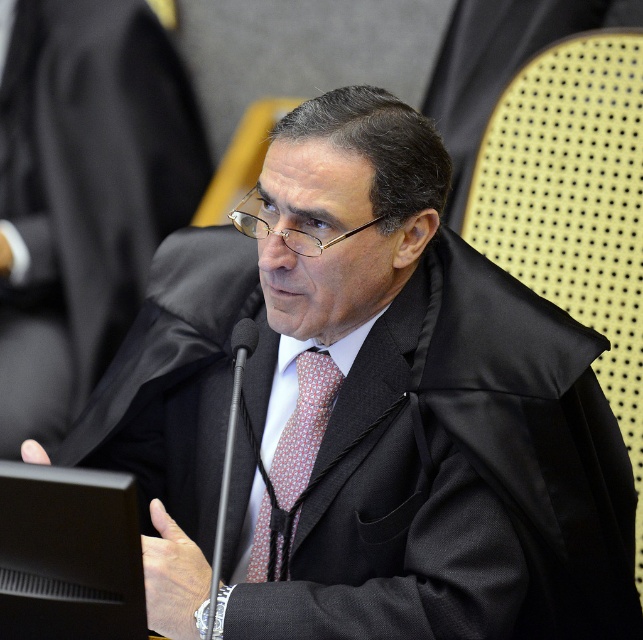
In the scene shown: Can you confirm if red dotted tie at center is taller than black plastic microphone at center?

Indeed, red dotted tie at center has a greater height compared to black plastic microphone at center.

Measure the distance between red dotted tie at center and camera.

They are 1.45 meters apart.

Who is more forward, (334,388) or (249,328)?

Point (249,328)

Locate an element on the screen. This screenshot has width=643, height=640. red dotted tie at center is located at coordinates (303, 426).

Is black satin robe at center taller than red dotted tie at center?

Yes.

Which is in front, point (134, 118) or point (309, 406)?

Point (309, 406) is in front.

Who is more distant from viewer, [66,248] or [316,365]?

Positioned behind is point [66,248].

I want to click on black satin robe at center, so click(84, 195).

Which is more to the left, black satin robe at center or black plastic microphone at center?

black satin robe at center is more to the left.

Can you confirm if black satin robe at center is thinner than black plastic microphone at center?

In fact, black satin robe at center might be wider than black plastic microphone at center.

The image size is (643, 640). Identify the location of black satin robe at center. (84, 195).